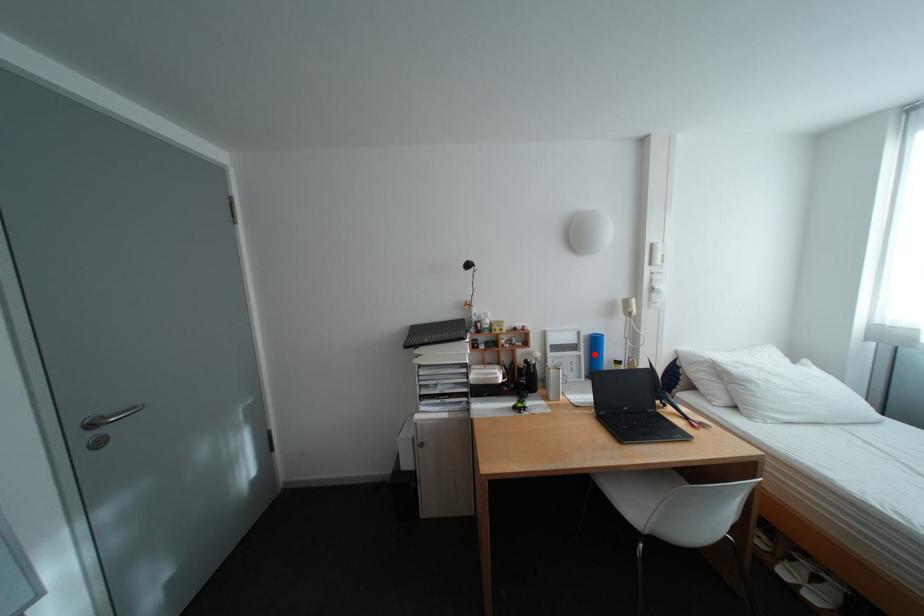
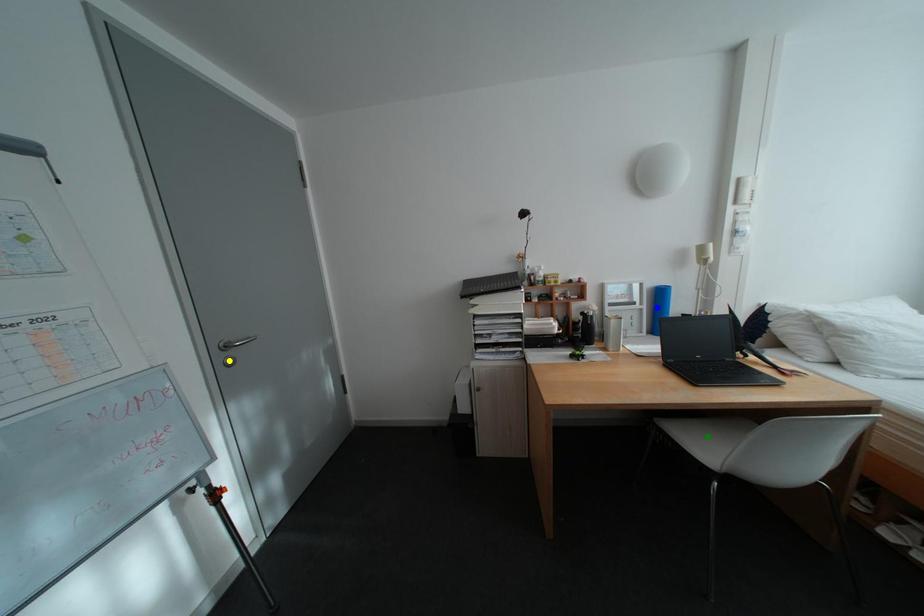
Question: I am providing you with two images of the same scene from different viewpoints. A red point is marked on the first image. You are given multiple points on the second image. Which point in image 2 represents the same 3d spot as the red point in image 1?

Choices:
 (A) blue point
 (B) green point
 (C) yellow point

Answer: (A)